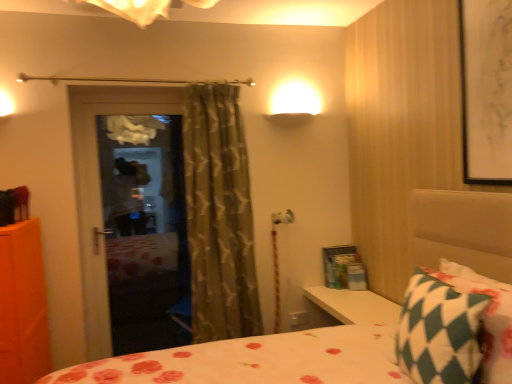
Question: Considering the relative sizes of white paper at upper right and green checkered pillow at lower right in the image provided, is white paper at upper right wider than green checkered pillow at lower right?

Choices:
 (A) yes
 (B) no

Answer: (B)

Question: From a real-world perspective, is white paper at upper right positioned under green checkered pillow at lower right based on gravity?

Choices:
 (A) yes
 (B) no

Answer: (B)

Question: Does white paper at upper right lie behind green checkered pillow at lower right?

Choices:
 (A) yes
 (B) no

Answer: (A)

Question: Is white paper at upper right not close to green checkered pillow at lower right?

Choices:
 (A) no
 (B) yes

Answer: (A)

Question: Is white paper at upper right aimed at green checkered pillow at lower right?

Choices:
 (A) yes
 (B) no

Answer: (B)

Question: Is white paper at upper right situated inside green checkered pillow at lower right or outside?

Choices:
 (A) outside
 (B) inside

Answer: (A)

Question: From the image's perspective, relative to green checkered pillow at lower right, is white paper at upper right above or below?

Choices:
 (A) above
 (B) below

Answer: (A)

Question: In the image, is white paper at upper right positioned in front of or behind green checkered pillow at lower right?

Choices:
 (A) front
 (B) behind

Answer: (B)

Question: Does point (476, 62) appear closer or farther from the camera than point (446, 339)?

Choices:
 (A) closer
 (B) farther

Answer: (B)

Question: Considering the positions of point (196, 155) and point (470, 137), is point (196, 155) closer or farther from the camera than point (470, 137)?

Choices:
 (A) farther
 (B) closer

Answer: (A)

Question: Based on their sizes in the image, would you say green textured curtain at center is bigger or smaller than white paper at upper right?

Choices:
 (A) small
 (B) big

Answer: (B)

Question: From the image's perspective, is green textured curtain at center positioned above or below white paper at upper right?

Choices:
 (A) below
 (B) above

Answer: (A)

Question: Is green textured curtain at center wider or thinner than white paper at upper right?

Choices:
 (A) thin
 (B) wide

Answer: (B)

Question: Would you say green textured curtain at center is inside or outside green checkered pillow at lower right?

Choices:
 (A) inside
 (B) outside

Answer: (B)

Question: Considering the relative positions of green textured curtain at center and green checkered pillow at lower right in the image provided, is green textured curtain at center to the left or to the right of green checkered pillow at lower right?

Choices:
 (A) left
 (B) right

Answer: (A)